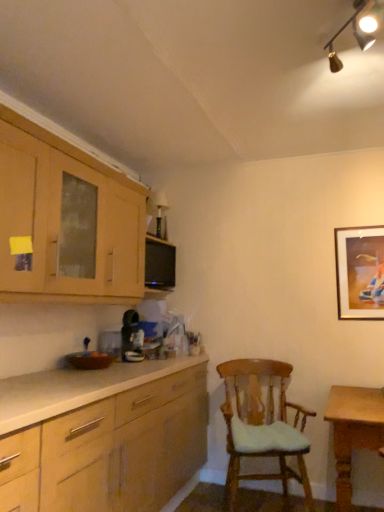
Question: Is gold-framed picture at upper right positioned behind wooden chair with cushion at center?

Choices:
 (A) no
 (B) yes

Answer: (B)

Question: From a real-world perspective, does gold-framed picture at upper right stand above wooden chair with cushion at center?

Choices:
 (A) no
 (B) yes

Answer: (B)

Question: From a real-world perspective, is gold-framed picture at upper right located beneath wooden chair with cushion at center?

Choices:
 (A) no
 (B) yes

Answer: (A)

Question: Can you confirm if gold-framed picture at upper right is positioned to the left of wooden chair with cushion at center?

Choices:
 (A) no
 (B) yes

Answer: (A)

Question: Does gold-framed picture at upper right have a lesser width compared to wooden chair with cushion at center?

Choices:
 (A) yes
 (B) no

Answer: (A)

Question: Is gold-framed picture at upper right far away from wooden chair with cushion at center?

Choices:
 (A) yes
 (B) no

Answer: (B)

Question: From a real-world perspective, is wooden cabinet at upper left located beneath wooden chair with cushion at center?

Choices:
 (A) yes
 (B) no

Answer: (B)

Question: Is wooden cabinet at upper left oriented away from wooden chair with cushion at center?

Choices:
 (A) no
 (B) yes

Answer: (A)

Question: Is wooden cabinet at upper left facing towards wooden chair with cushion at center?

Choices:
 (A) no
 (B) yes

Answer: (A)

Question: Is wooden cabinet at upper left positioned behind wooden chair with cushion at center?

Choices:
 (A) yes
 (B) no

Answer: (B)

Question: Is wooden cabinet at upper left next to wooden chair with cushion at center and touching it?

Choices:
 (A) yes
 (B) no

Answer: (B)

Question: Considering the relative positions of wooden cabinet at upper left and wooden chair with cushion at center in the image provided, is wooden cabinet at upper left to the left of wooden chair with cushion at center from the viewer's perspective?

Choices:
 (A) yes
 (B) no

Answer: (A)

Question: Is wooden cabinet at upper left oriented away from wooden table at lower right?

Choices:
 (A) yes
 (B) no

Answer: (B)